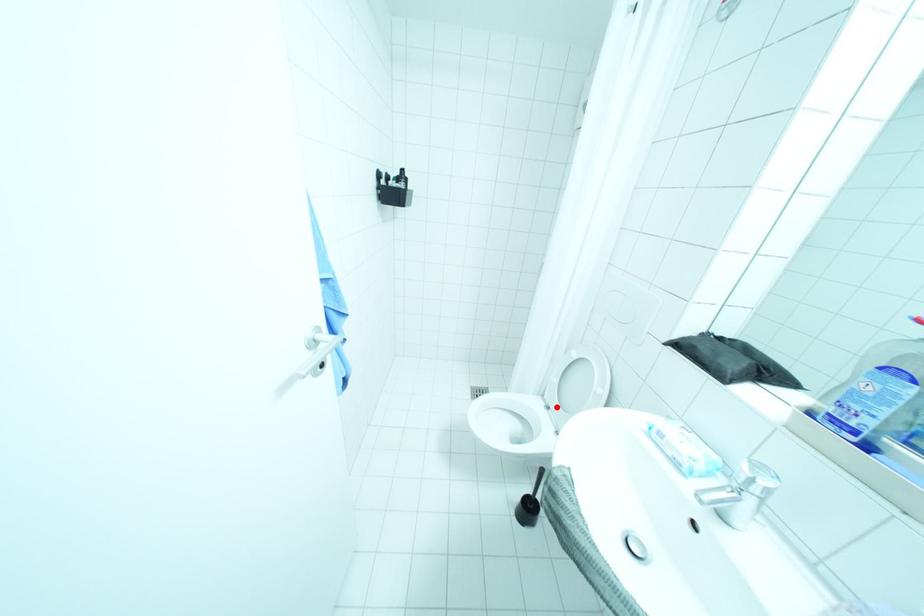
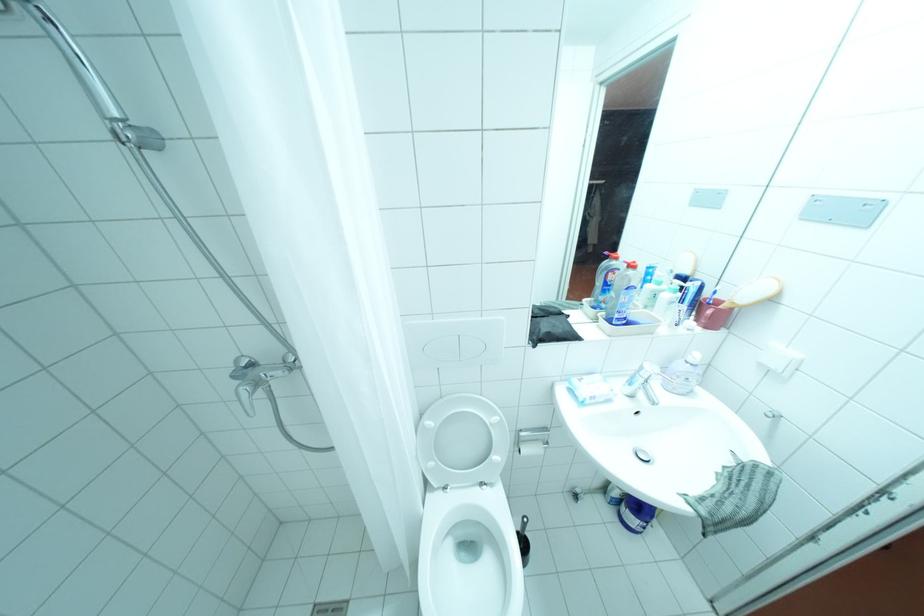
Question: A red point is marked in image1. In image2, is the corresponding 3D point closer to the camera or farther? Reply with the corresponding letter.

Choices:
 (A) The corresponding 3D point is closer.
 (B) The corresponding 3D point is farther.

Answer: (B)